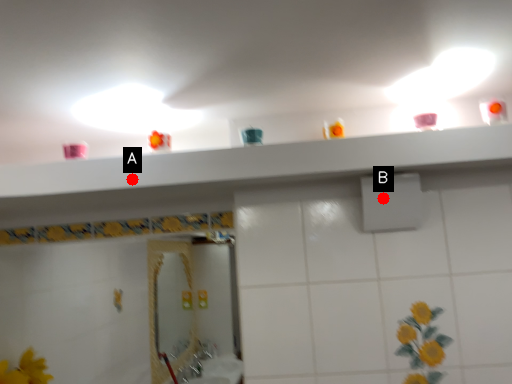
Question: Two points are circled on the image, labeled by A and B beside each circle. Which point is farther from the camera taking this photo?

Choices:
 (A) A is further
 (B) B is further

Answer: (B)